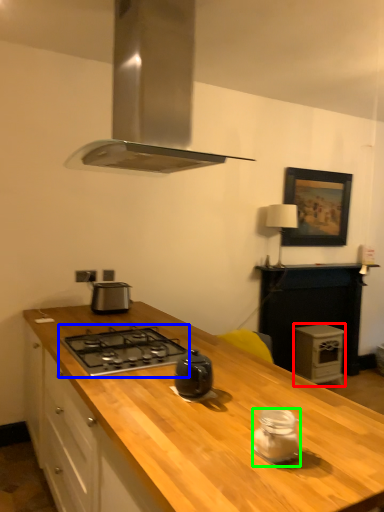
Question: Estimate the real-world distances between objects in this image. Which object is closer to appliance (highlighted by a red box), gas stove (highlighted by a blue box) or kitchen appliance (highlighted by a green box)?

Choices:
 (A) gas stove
 (B) kitchen appliance

Answer: (A)